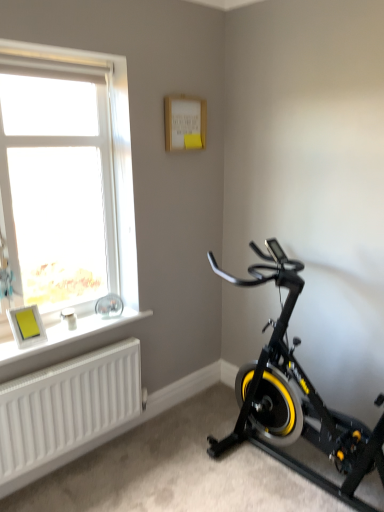
Question: Is white matte radiator at lower left far from black matte stationary bicycle at lower right?

Choices:
 (A) no
 (B) yes

Answer: (A)

Question: Is white matte radiator at lower left shorter than black matte stationary bicycle at lower right?

Choices:
 (A) no
 (B) yes

Answer: (B)

Question: From the image's perspective, is white matte radiator at lower left located above black matte stationary bicycle at lower right?

Choices:
 (A) no
 (B) yes

Answer: (A)

Question: From the image's perspective, is white matte radiator at lower left beneath black matte stationary bicycle at lower right?

Choices:
 (A) yes
 (B) no

Answer: (A)

Question: Is white matte radiator at lower left thinner than black matte stationary bicycle at lower right?

Choices:
 (A) no
 (B) yes

Answer: (B)

Question: Does white matte radiator at lower left lie in front of black matte stationary bicycle at lower right?

Choices:
 (A) yes
 (B) no

Answer: (B)

Question: Is white plastic window at upper left with white matte window sill at lower left?

Choices:
 (A) yes
 (B) no

Answer: (B)

Question: From a real-world perspective, is white plastic window at upper left below white matte window sill at lower left?

Choices:
 (A) no
 (B) yes

Answer: (A)

Question: Is white plastic window at upper left looking in the opposite direction of white matte window sill at lower left?

Choices:
 (A) yes
 (B) no

Answer: (B)

Question: Is white plastic window at upper left further to camera compared to white matte window sill at lower left?

Choices:
 (A) no
 (B) yes

Answer: (A)

Question: Can you confirm if white plastic window at upper left is thinner than white matte window sill at lower left?

Choices:
 (A) no
 (B) yes

Answer: (B)

Question: From the image's perspective, would you say white plastic window at upper left is shown under white matte window sill at lower left?

Choices:
 (A) yes
 (B) no

Answer: (B)

Question: Is white plastic window at upper left turned away from matte yellow picture frame at lower left?

Choices:
 (A) yes
 (B) no

Answer: (A)